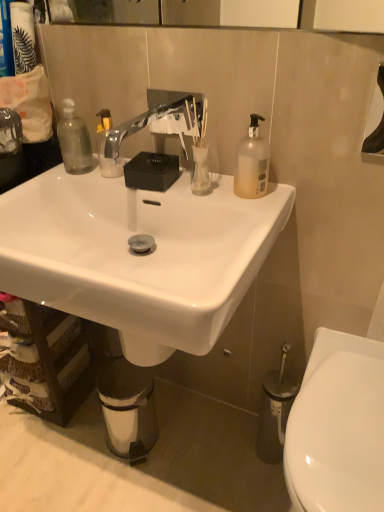
Question: Considering the positions of white glossy toilet at lower right and metallic silver trash can at lower center in the image, is white glossy toilet at lower right taller or shorter than metallic silver trash can at lower center?

Choices:
 (A) tall
 (B) short

Answer: (A)

Question: Does point (342, 344) appear closer or farther from the camera than point (150, 417)?

Choices:
 (A) farther
 (B) closer

Answer: (B)

Question: Which is nearer to the transparent glass vase at center?

Choices:
 (A) matte black canister at upper left
 (B) metallic silver trash can at lower center
 (C) white glossy sink at center
 (D) brown woven basket at lower left
 (E) translucent plastic bottle at upper right

Answer: (E)

Question: Which is farther from the white glossy sink at center?

Choices:
 (A) silver metallic faucet at center
 (B) matte black canister at upper left
 (C) transparent glass vase at center
 (D) translucent plastic bottle at upper right
 (E) metallic silver trash can at lower center

Answer: (E)